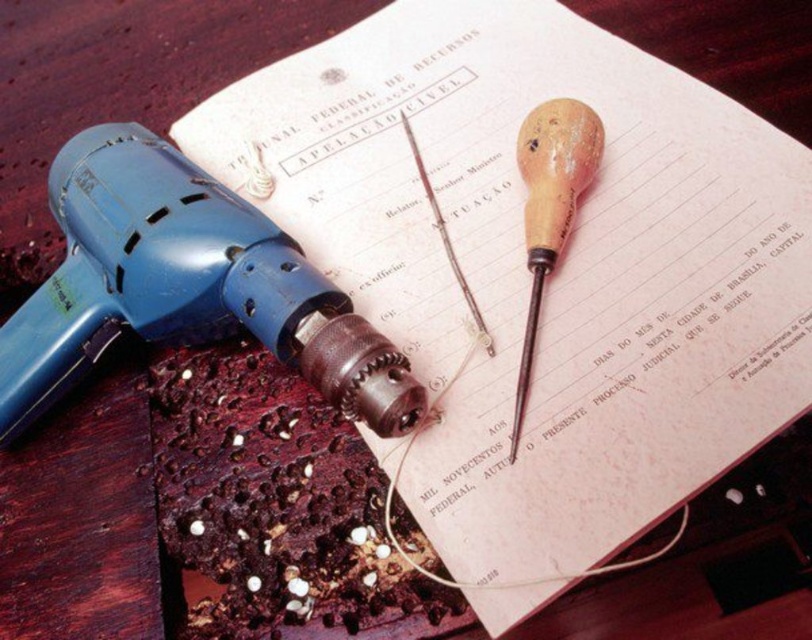
Does point (378, 433) come behind point (566, 189)?

No, it is not.

Which is behind, point (214, 282) or point (556, 124)?

The point (556, 124) is more distant.

Where is `blue plastic drill at left`? blue plastic drill at left is located at coordinates (184, 285).